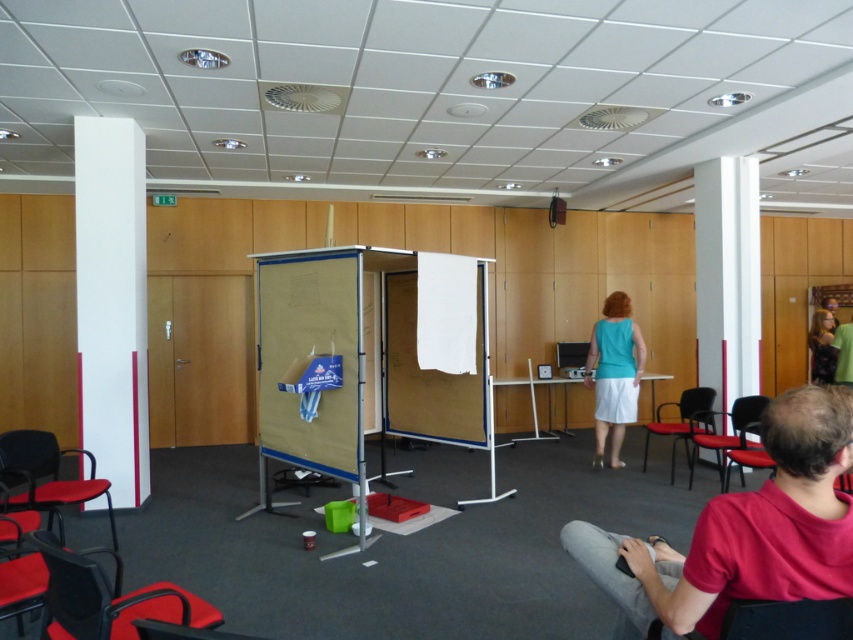
Can you confirm if black plastic chair at lower left is taller than matte plastic chair at right?

No.

From the picture: Can you confirm if black plastic chair at lower left is shorter than matte plastic chair at right?

Correct, black plastic chair at lower left is not as tall as matte plastic chair at right.

In order to click on black plastic chair at lower left in this screenshot , I will do coord(107,596).

The height and width of the screenshot is (640, 853). I want to click on black plastic chair at lower left, so click(x=107, y=596).

Between black plastic chair at lower left and black leather chair at lower right, which one has less height?

Standing shorter between the two is black leather chair at lower right.

Can you confirm if black plastic chair at lower left is shorter than black leather chair at lower right?

In fact, black plastic chair at lower left may be taller than black leather chair at lower right.

This screenshot has height=640, width=853. Identify the location of black plastic chair at lower left. (107, 596).

Who is more distant from viewer, (732, 198) or (813, 604)?

The point (732, 198) is behind.

Does white glossy pillar at right have a greater height compared to black leather chair at lower right?

Yes, white glossy pillar at right is taller than black leather chair at lower right.

Which is in front, point (740, 369) or point (830, 632)?

Point (830, 632) is more forward.

I want to click on white glossy pillar at right, so click(x=727, y=276).